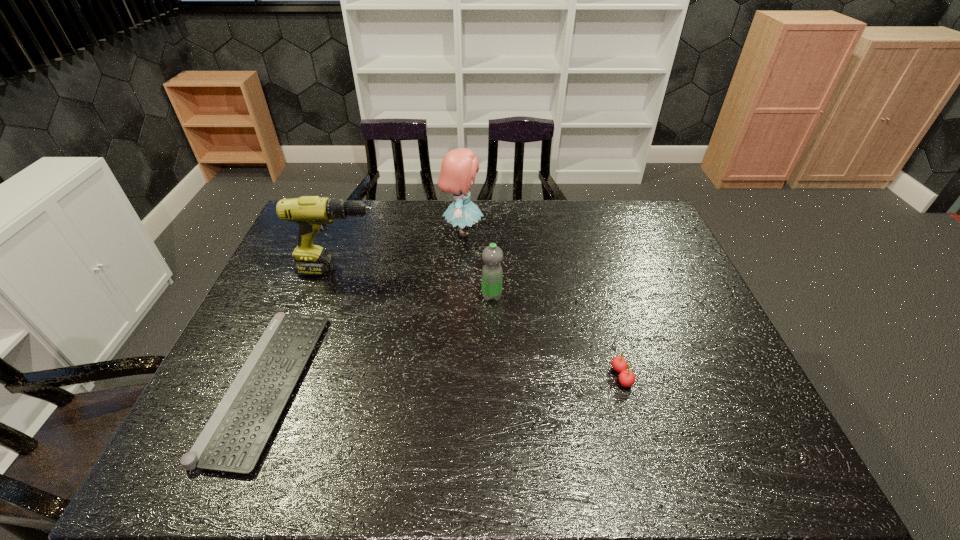
Select which object is the second closest to the doll. Please provide its 2D coordinates. Your answer should be formatted as a tuple, i.e. [(x, y)], where the tuple contains the x and y coordinates of a point satisfying the conditions above.

[(312, 213)]

Where is `blank area in the image that satisfies the following two spatial constraints: 1. on the front-facing side of the farthest object; 2. on the back side of the cherry`? This screenshot has width=960, height=540. blank area in the image that satisfies the following two spatial constraints: 1. on the front-facing side of the farthest object; 2. on the back side of the cherry is located at coordinates (455, 376).

Image resolution: width=960 pixels, height=540 pixels. What are the coordinates of `vacant point that satisfies the following two spatial constraints: 1. on the handle side of the drill; 2. on the back side of the rightmost object` in the screenshot? It's located at (303, 376).

Locate an element on the screen. Image resolution: width=960 pixels, height=540 pixels. free space that satisfies the following two spatial constraints: 1. on the handle side of the fourth nearest object; 2. on the left side of the third tallest object is located at coordinates (331, 296).

Where is `free location that satisfies the following two spatial constraints: 1. on the handle side of the third farthest object; 2. on the left side of the drill`? free location that satisfies the following two spatial constraints: 1. on the handle side of the third farthest object; 2. on the left side of the drill is located at coordinates (331, 296).

This screenshot has width=960, height=540. I want to click on vacant point that satisfies the following two spatial constraints: 1. on the handle side of the second farthest object; 2. on the right side of the fourth tallest object, so click(303, 376).

Find the location of `vacant area that satisfies the following two spatial constraints: 1. on the front-facing side of the doll; 2. on the front side of the shortest object`. vacant area that satisfies the following two spatial constraints: 1. on the front-facing side of the doll; 2. on the front side of the shortest object is located at coordinates [455, 384].

Find the location of a particular element. The image size is (960, 540). blank area in the image that satisfies the following two spatial constraints: 1. on the front-facing side of the farthest object; 2. on the front side of the shortest object is located at coordinates (455, 384).

The image size is (960, 540). In order to click on vacant space that satisfies the following two spatial constraints: 1. on the front-facing side of the doll; 2. on the left side of the water bottle in this screenshot , I will do `click(459, 296)`.